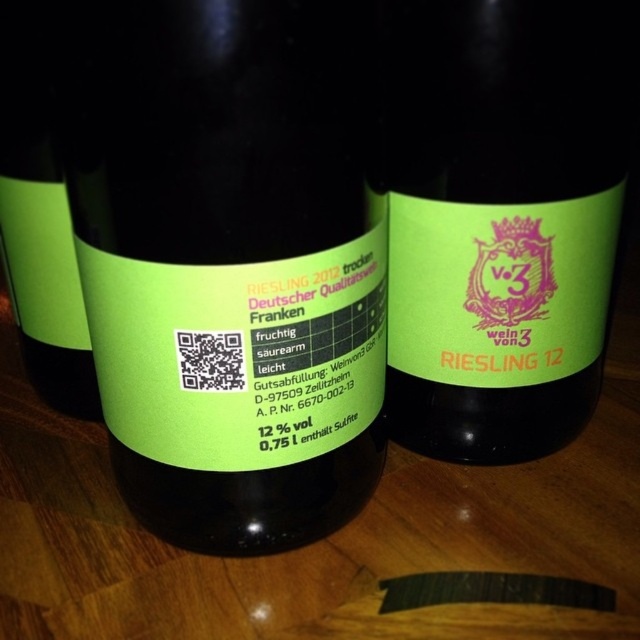
Does point (204, 307) come behind point (60, 285)?

No, it is in front of (60, 285).

Is green matte label at center positioned at the back of green matte bottle at center?

No.

Who is more distant from viewer, (252, 451) or (90, 355)?

The point (90, 355) is behind.

The width and height of the screenshot is (640, 640). What are the coordinates of `green matte label at center` in the screenshot? It's located at (230, 260).

Which is above, green matte label at center or matte green label at center?

matte green label at center

Can you confirm if green matte label at center is taller than matte green label at center?

Indeed, green matte label at center has a greater height compared to matte green label at center.

Where is `green matte label at center`? green matte label at center is located at coordinates (230, 260).

Can you confirm if matte green label at center is positioned above green matte bottle at center?

No.

Is point (419, 10) positioned before point (1, 10)?

Yes, it is.

Does point (404, 237) come in front of point (36, 333)?

Yes, point (404, 237) is in front of point (36, 333).

What are the coordinates of `matte green label at center` in the screenshot? It's located at (504, 218).